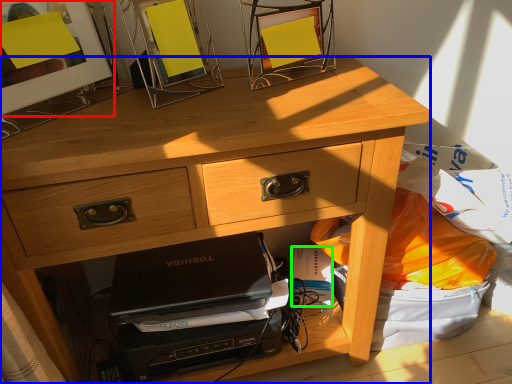
Question: Considering the real-world distances, which object is farthest from picture frame (highlighted by a red box)? desk (highlighted by a blue box) or paperback book (highlighted by a green box)?

Choices:
 (A) desk
 (B) paperback book

Answer: (B)